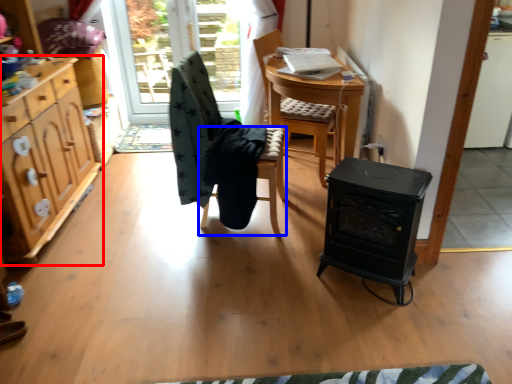
Question: Which of the following is the closest to the observer, cabinetry (highlighted by a red box) or chair (highlighted by a blue box)?

Choices:
 (A) cabinetry
 (B) chair

Answer: (A)